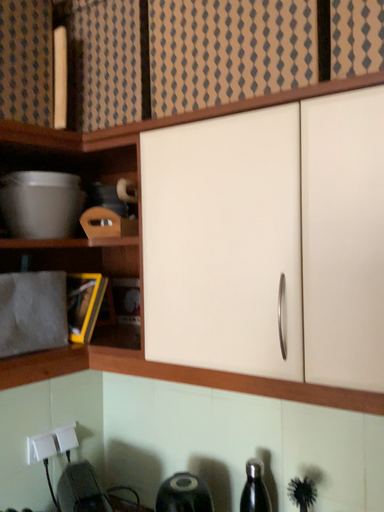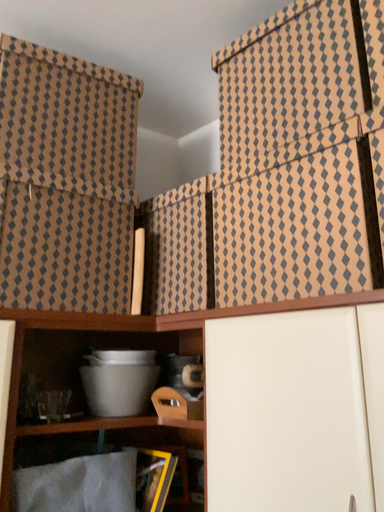
Question: How did the camera likely rotate when shooting the video?

Choices:
 (A) rotated downward
 (B) rotated upward

Answer: (B)